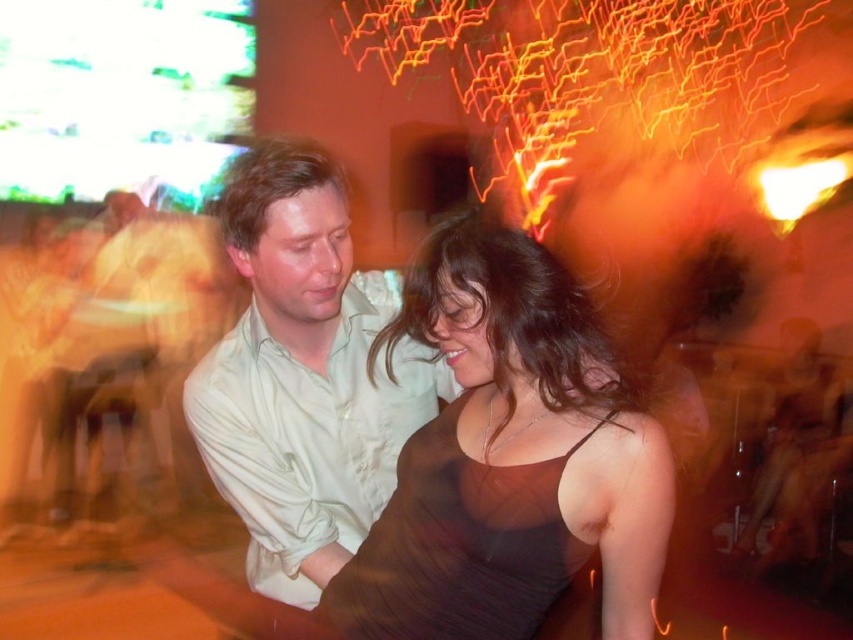
You are a photographer at a party and want to take a photo of the brown satin dress at center and the light beige shirt at center. Which one should you focus on if you want to capture the lower part of the scene?

The brown satin dress at center is located below the light beige shirt at center, so you should focus on the brown satin dress at center to capture the lower part of the scene.

You are a photographer at a party and need to adjust the lighting so that both the brown satin dress at center and the light beige shirt at center are well illuminated. Since one is taller than the other, which one might require a higher light placement to ensure proper exposure?

The light beige shirt at center requires higher light placement because it is taller than the brown satin dress at center.

You are at a party and want to take a photo of both the brown satin dress at center and the light beige shirt at center. Since you can only focus on one person at a time, which one should you aim the camera at first to ensure the other is still in the frame?

You should aim the camera at the light beige shirt at center first because the brown satin dress at center is to the right of it, so by focusing on the left side, the right side will still be in the frame.